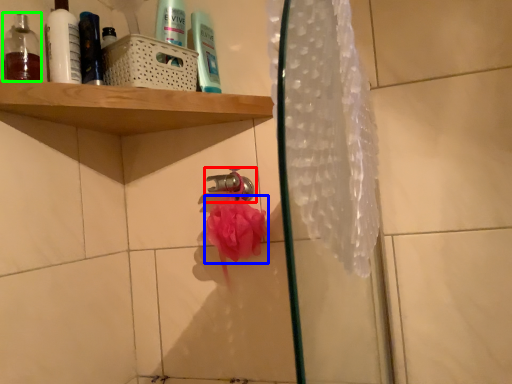
Question: Which is farther away from tap (highlighted by a red box)? flower (highlighted by a blue box) or mouthwash (highlighted by a green box)?

Choices:
 (A) flower
 (B) mouthwash

Answer: (B)